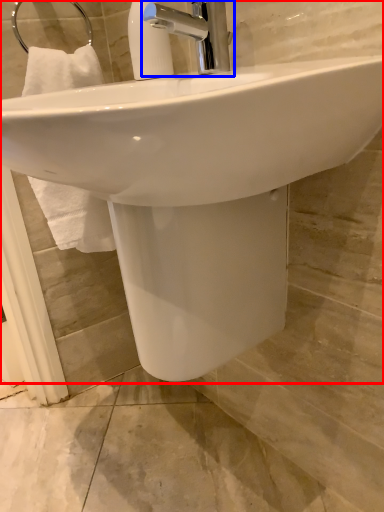
Question: Which point is closer to the camera, sink (highlighted by a red box) or tap (highlighted by a blue box)?

Choices:
 (A) sink
 (B) tap

Answer: (A)